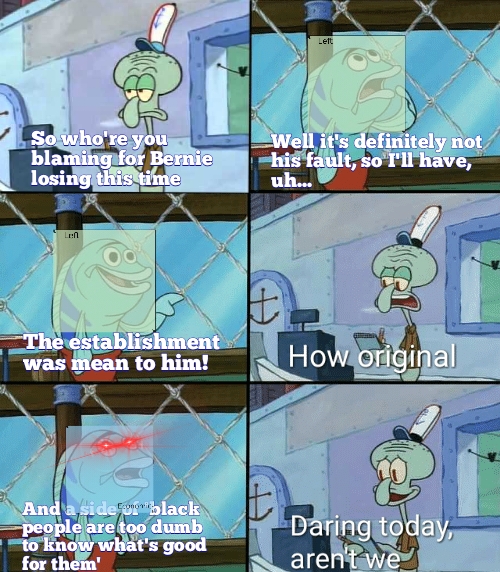
Locate an element on the screen. notepad is located at coordinates (368, 548), (372, 340), (113, 153).